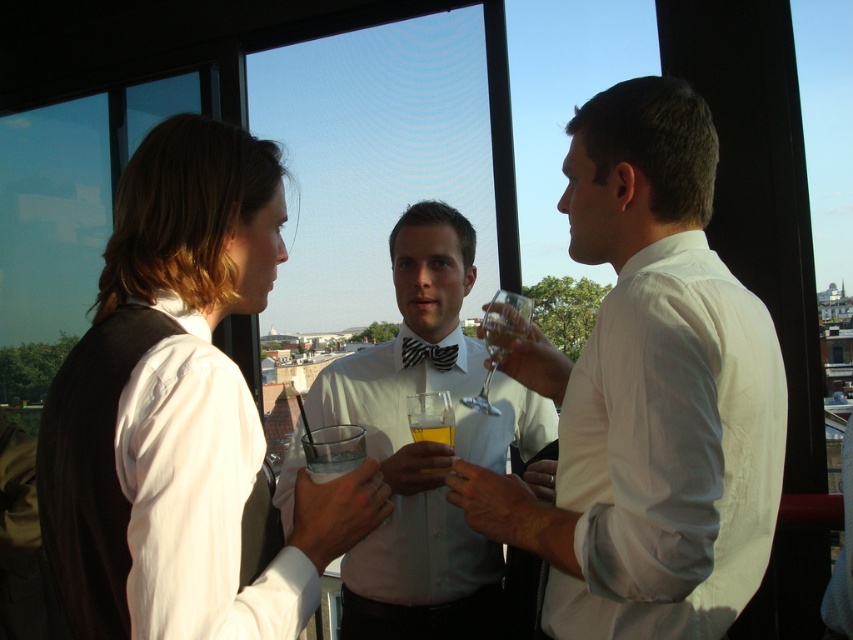
Can you confirm if white glossy bow tie at center is wider than black striped bow tie at center?

Yes.

Does white glossy bow tie at center have a lesser height compared to black striped bow tie at center?

In fact, white glossy bow tie at center may be taller than black striped bow tie at center.

The image size is (853, 640). I want to click on white glossy bow tie at center, so click(426, 449).

Does white smooth shirt at center appear under matte white shirt at center?

Yes.

Describe the element at coordinates (648, 394) in the screenshot. The image size is (853, 640). I see `white smooth shirt at center` at that location.

This screenshot has width=853, height=640. What are the coordinates of `white smooth shirt at center` in the screenshot? It's located at (648, 394).

Does clear glass wine glass at center have a smaller size compared to translucent glass at center?

No.

Who is positioned more to the right, clear glass wine glass at center or translucent glass at center?

clear glass wine glass at center

Does point (488, 330) lie in front of point (440, 410)?

No, it is behind (440, 410).

At what (x,y) coordinates should I click in order to perform the action: click on clear glass wine glass at center. Please return your answer as a coordinate pair (x, y). The width and height of the screenshot is (853, 640). Looking at the image, I should click on (500, 339).